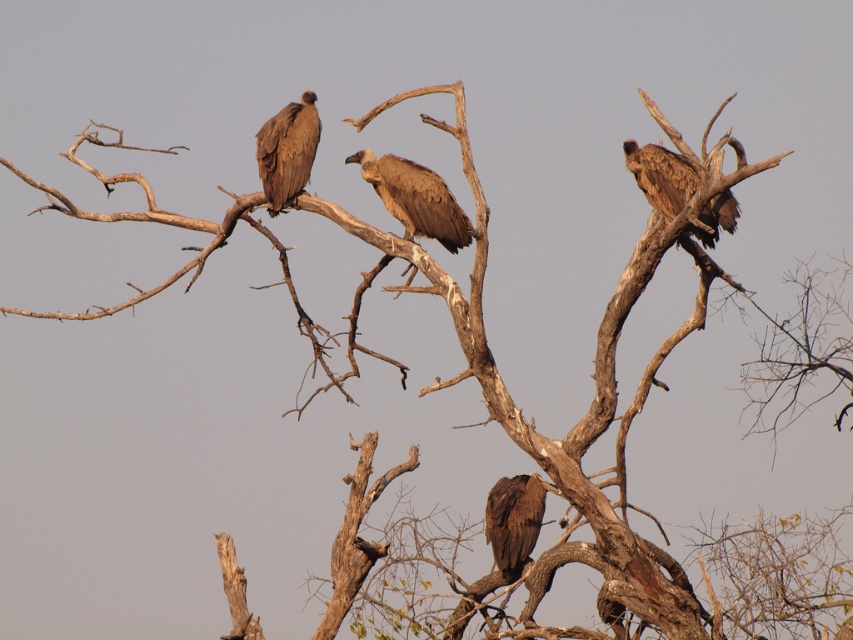
Does brown feathered vulture at upper left have a lesser width compared to brown feathered eagle at lower center?

No, brown feathered vulture at upper left is not thinner than brown feathered eagle at lower center.

Is point (308, 152) less distant than point (503, 554)?

Yes, it is.

Where is `brown feathered vulture at upper left`? This screenshot has width=853, height=640. brown feathered vulture at upper left is located at coordinates (287, 150).

Find the location of `brown feathered vulture at upper left`. brown feathered vulture at upper left is located at coordinates (287, 150).

Is brown feathered eagle at upper right positioned in front of brown feathered eagle at lower center?

Yes, brown feathered eagle at upper right is in front of brown feathered eagle at lower center.

Does brown feathered eagle at upper right appear on the right side of brown feathered eagle at lower center?

Indeed, brown feathered eagle at upper right is positioned on the right side of brown feathered eagle at lower center.

Identify the location of brown feathered eagle at upper right. Image resolution: width=853 pixels, height=640 pixels. (660, 177).

Between brown feathered eagle at center and brown feathered eagle at lower center, which one is positioned higher?

brown feathered eagle at center

Who is lower down, brown feathered eagle at center or brown feathered eagle at lower center?

Positioned lower is brown feathered eagle at lower center.

Which is in front, point (374, 160) or point (515, 492)?

Point (374, 160) is in front.

This screenshot has height=640, width=853. Find the location of `brown feathered eagle at center`. brown feathered eagle at center is located at coordinates (415, 198).